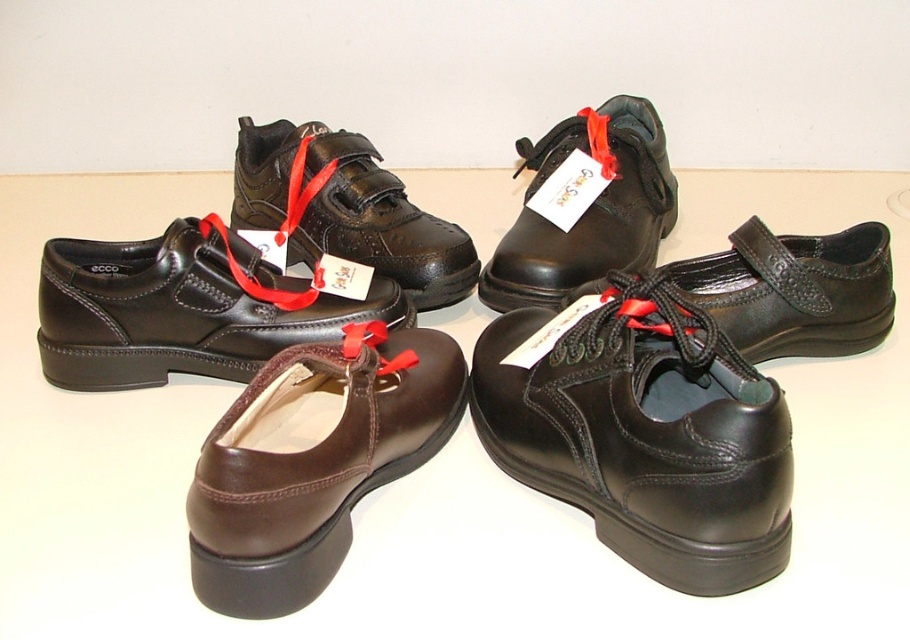
You are organizing shoes in a display. You have a black leather shoe at upper left and a black leather shoe at center. Which one should you place in the larger size section?

The black leather shoe at upper left should be placed in the larger size section because it is bigger than the black leather shoe at center.

You are organizing shoes on a shelf and notice the matte black shoe at lower left and the black leather shoe at center. Which shoe is placed higher up on the shelf?

The matte black shoe at lower left is positioned over the black leather shoe at center, so it is placed higher up on the shelf.

What is the color of the shoe located at point (644,438)?

The shoe at point (644,438) is a black leather shoe.